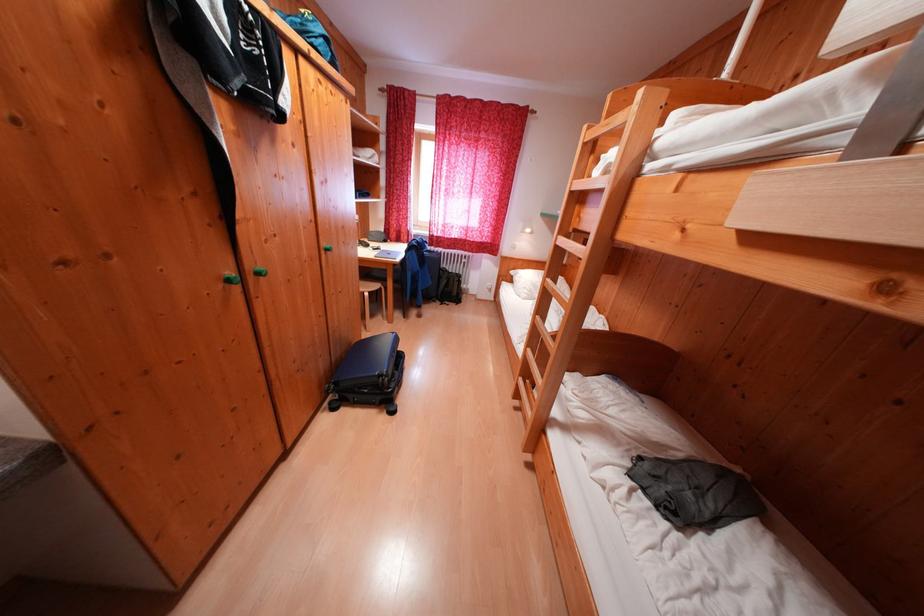
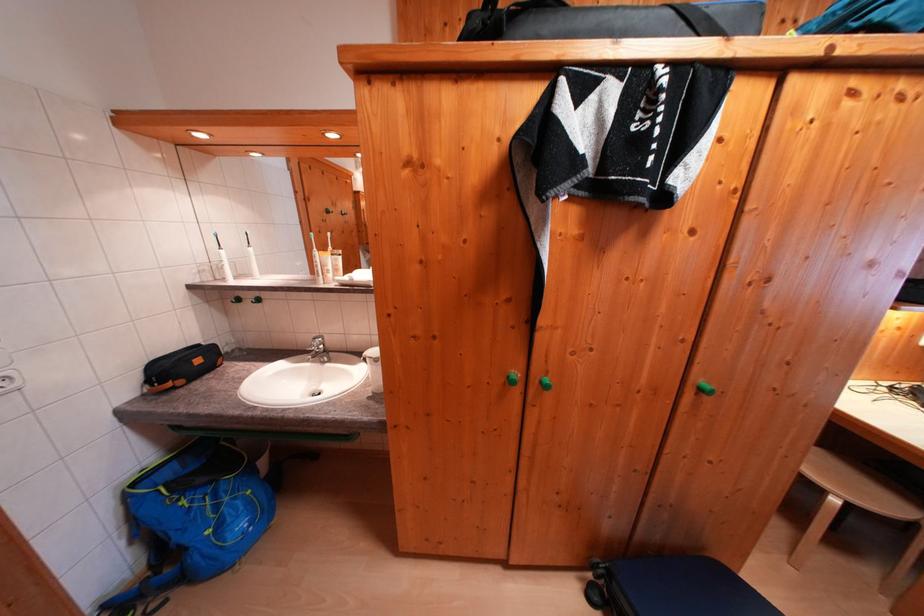
Find the pixel in the second image that matches the point at 335,254 in the first image.

(709, 394)